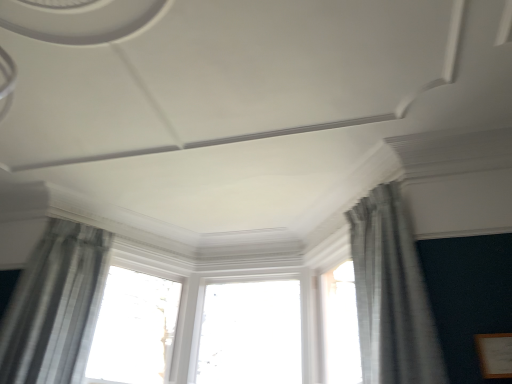
What do you see at coordinates (391, 294) in the screenshot? I see `gray sheer curtain at upper right, the 2th curtain positioned from the left` at bounding box center [391, 294].

Find the location of a particular element. white glossy window at center is located at coordinates (134, 329).

This screenshot has width=512, height=384. What are the coordinates of `sheer gray curtain at left, marked as the second curtain in a right-to-left arrangement` in the screenshot? It's located at (55, 306).

The height and width of the screenshot is (384, 512). What do you see at coordinates (55, 306) in the screenshot? I see `sheer gray curtain at left, the 1th curtain positioned from the left` at bounding box center [55, 306].

The width and height of the screenshot is (512, 384). I want to click on gray sheer curtain at upper right, the 2th curtain positioned from the left, so click(x=391, y=294).

Is the surface of white glossy window at center in direct contact with gray sheer curtain at upper right, acting as the 1th curtain starting from the right?

No, white glossy window at center is not making contact with gray sheer curtain at upper right, acting as the 1th curtain starting from the right.

Does white glossy window at center come in front of gray sheer curtain at upper right, the 2th curtain positioned from the left?

No, white glossy window at center is behind gray sheer curtain at upper right, the 2th curtain positioned from the left.

From the image's perspective, is white glossy window at center over gray sheer curtain at upper right, acting as the 1th curtain starting from the right?

No.

How different are the orientations of white glossy window at center and gray sheer curtain at upper right, the 2th curtain positioned from the left, in degrees?

112 degrees separate the facing orientations of white glossy window at center and gray sheer curtain at upper right, the 2th curtain positioned from the left.

Does sheer gray curtain at left, the 1th curtain positioned from the left, have a lesser height compared to gray sheer curtain at upper right, acting as the 1th curtain starting from the right?

In fact, sheer gray curtain at left, the 1th curtain positioned from the left, may be taller than gray sheer curtain at upper right, acting as the 1th curtain starting from the right.

From the picture: Which object is further away from the camera, sheer gray curtain at left, the 1th curtain positioned from the left, or gray sheer curtain at upper right, acting as the 1th curtain starting from the right?

sheer gray curtain at left, the 1th curtain positioned from the left.

The height and width of the screenshot is (384, 512). In order to click on curtain located behind the gray sheer curtain at upper right, the 2th curtain positioned from the left in this screenshot , I will do `click(55, 306)`.

How different are the orientations of gray sheer curtain at upper right, acting as the 1th curtain starting from the right, and sheer gray curtain at left, marked as the second curtain in a right-to-left arrangement, in degrees?

98.4 degrees.

Could you tell me if gray sheer curtain at upper right, the 2th curtain positioned from the left, is facing sheer gray curtain at left, marked as the second curtain in a right-to-left arrangement?

A: No, gray sheer curtain at upper right, the 2th curtain positioned from the left, is not oriented towards sheer gray curtain at left, marked as the second curtain in a right-to-left arrangement.

Does gray sheer curtain at upper right, acting as the 1th curtain starting from the right, appear on the left side of sheer gray curtain at left, the 1th curtain positioned from the left?

No.

From the image's perspective, would you say gray sheer curtain at upper right, acting as the 1th curtain starting from the right, is shown under sheer gray curtain at left, the 1th curtain positioned from the left?

No.

Does sheer gray curtain at left, marked as the second curtain in a right-to-left arrangement, turn towards white glossy window at center?

No, sheer gray curtain at left, marked as the second curtain in a right-to-left arrangement, does not turn towards white glossy window at center.

Considering the relative sizes of sheer gray curtain at left, marked as the second curtain in a right-to-left arrangement, and white glossy window at center in the image provided, is sheer gray curtain at left, marked as the second curtain in a right-to-left arrangement, bigger than white glossy window at center?

Yes, sheer gray curtain at left, marked as the second curtain in a right-to-left arrangement, is bigger than white glossy window at center.

Which object is positioned more to the right, sheer gray curtain at left, marked as the second curtain in a right-to-left arrangement, or white glossy window at center?

Positioned to the right is white glossy window at center.

Is white glossy window at center facing towards sheer gray curtain at left, marked as the second curtain in a right-to-left arrangement?

No.

Is white glossy window at center located outside sheer gray curtain at left, the 1th curtain positioned from the left?

Yes, white glossy window at center is outside of sheer gray curtain at left, the 1th curtain positioned from the left.

Considering the relative sizes of white glossy window at center and sheer gray curtain at left, the 1th curtain positioned from the left, in the image provided, is white glossy window at center thinner than sheer gray curtain at left, the 1th curtain positioned from the left,?

Correct, the width of white glossy window at center is less than that of sheer gray curtain at left, the 1th curtain positioned from the left.

Which point is more distant from viewer, [99,381] or [36,260]?

The point [99,381] is behind.

In the scene shown: Is gray sheer curtain at upper right, the 2th curtain positioned from the left, positioned far away from white glossy window at center?

Yes.

Looking at this image, does gray sheer curtain at upper right, acting as the 1th curtain starting from the right, have a lesser height compared to white glossy window at center?

In fact, gray sheer curtain at upper right, acting as the 1th curtain starting from the right, may be taller than white glossy window at center.

Which of these two, gray sheer curtain at upper right, acting as the 1th curtain starting from the right, or white glossy window at center, is wider?

gray sheer curtain at upper right, acting as the 1th curtain starting from the right.

From the image's perspective, is gray sheer curtain at upper right, the 2th curtain positioned from the left, beneath white glossy window at center?

No.

At what (x,y) coordinates should I click in order to perform the action: click on curtain that appears on the right of white glossy window at center. Please return your answer as a coordinate pair (x, y). Looking at the image, I should click on (391, 294).

Locate an element on the screen. This screenshot has height=384, width=512. curtain in front of the sheer gray curtain at left, marked as the second curtain in a right-to-left arrangement is located at coordinates (391, 294).

Based on their spatial positions, is gray sheer curtain at upper right, the 2th curtain positioned from the left, or sheer gray curtain at left, the 1th curtain positioned from the left, closer to white glossy window at center?

sheer gray curtain at left, the 1th curtain positioned from the left, lies closer to white glossy window at center than the other object.

When comparing their distances from white glossy window at center, does sheer gray curtain at left, marked as the second curtain in a right-to-left arrangement, or gray sheer curtain at upper right, acting as the 1th curtain starting from the right, seem closer?

sheer gray curtain at left, marked as the second curtain in a right-to-left arrangement.

From the picture: Looking at the image, which one is located further to gray sheer curtain at upper right, the 2th curtain positioned from the left, white glossy window at center or sheer gray curtain at left, the 1th curtain positioned from the left?

sheer gray curtain at left, the 1th curtain positioned from the left, is positioned further to the anchor gray sheer curtain at upper right, the 2th curtain positioned from the left.

Based on their spatial positions, is gray sheer curtain at upper right, the 2th curtain positioned from the left, or white glossy window at center closer to sheer gray curtain at left, the 1th curtain positioned from the left?

Based on the image, white glossy window at center appears to be nearer to sheer gray curtain at left, the 1th curtain positioned from the left.

When comparing their distances from gray sheer curtain at upper right, the 2th curtain positioned from the left, does sheer gray curtain at left, the 1th curtain positioned from the left, or white glossy window at center seem closer?

white glossy window at center is closer to gray sheer curtain at upper right, the 2th curtain positioned from the left.

Looking at the image, which one is located further to sheer gray curtain at left, the 1th curtain positioned from the left, white glossy window at center or gray sheer curtain at upper right, the 2th curtain positioned from the left?

Among the two, gray sheer curtain at upper right, the 2th curtain positioned from the left, is located further to sheer gray curtain at left, the 1th curtain positioned from the left.

Identify the location of window between sheer gray curtain at left, marked as the second curtain in a right-to-left arrangement, and gray sheer curtain at upper right, the 2th curtain positioned from the left, in the horizontal direction. The width and height of the screenshot is (512, 384). (134, 329).